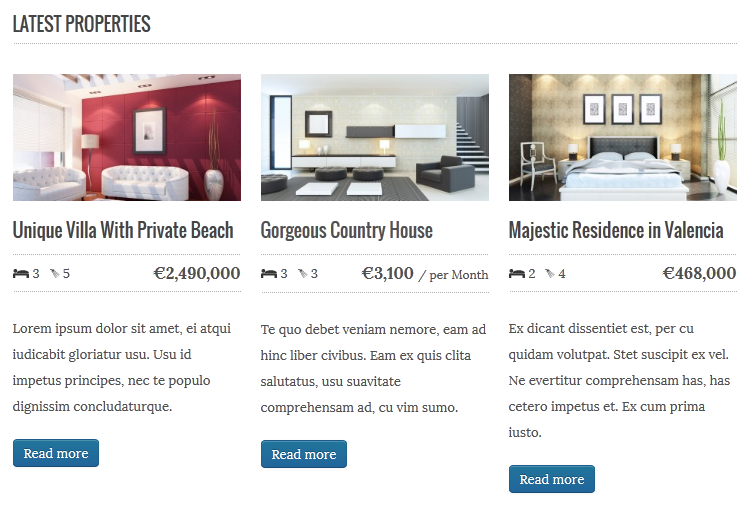
This screenshot has height=520, width=754. I want to click on red wall, so click(x=185, y=129).